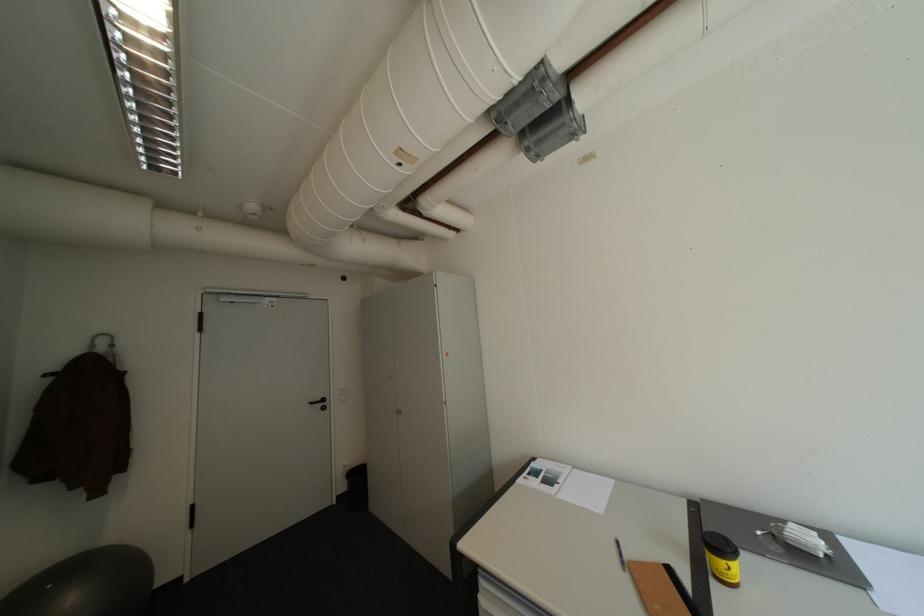
The location [357,484] corresponds to which object?

This point indicates the black trash can.